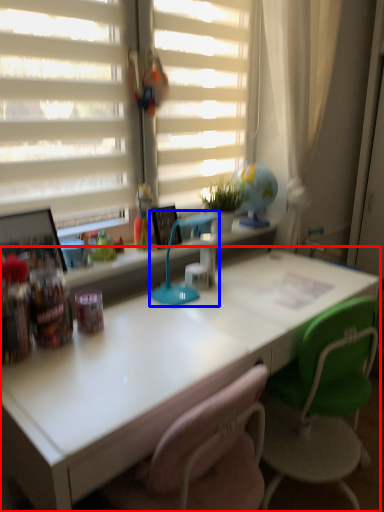
Question: Which object is closer to the camera taking this photo, desk (highlighted by a red box) or table lamp (highlighted by a blue box)?

Choices:
 (A) desk
 (B) table lamp

Answer: (A)